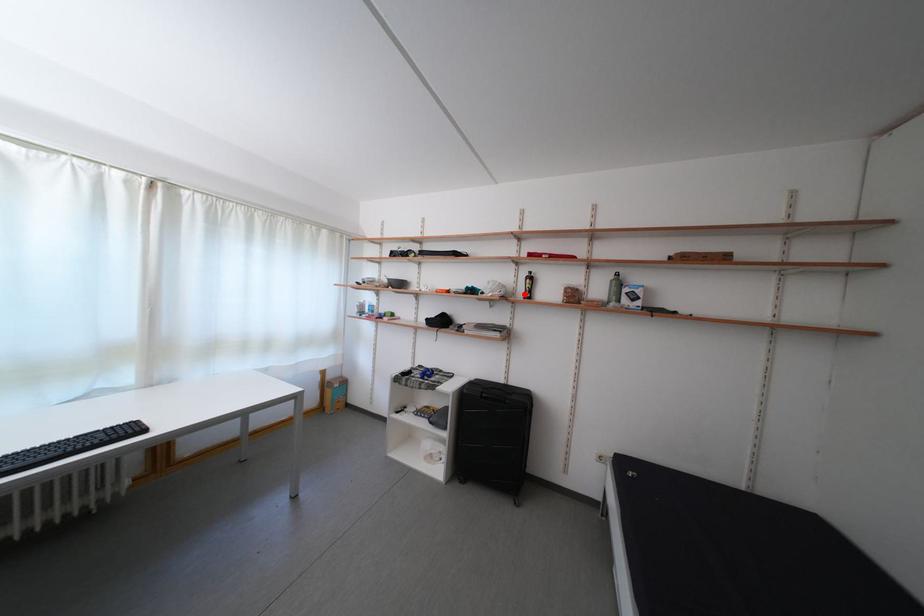
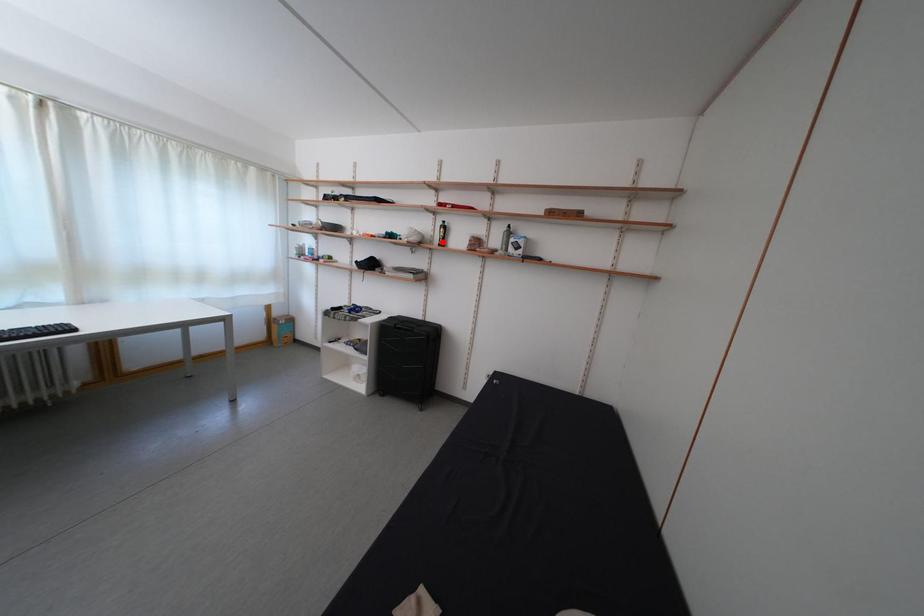
I am providing you with two images of the same scene from different viewpoints. A red point is marked on the first image and another point is marked on the second image. Are the points marked in image1 and image2 representing the same 3D position?

Yes